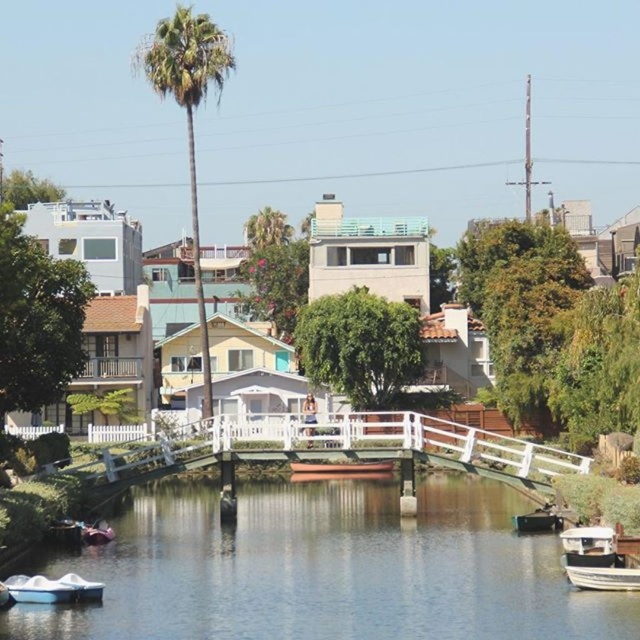
You are standing at the edge of the canal and notice a green leafy palm tree at upper left. If you want to take a photo of the palm tree with the white pedestrian bridge in the background, which direction should you face?

The green leafy palm tree at upper left is 81.70 meters from the viewer. To include the white pedestrian bridge in the background while photographing the palm tree, you should face towards the bridge, ensuring both the tree and bridge are within your camera frame.

You are a tourist standing on the white pedestrian bridge and want to take a photo of both the green leafy palm tree at upper left and the white glossy boat at lower right. Can you position yourself so that both are visible in the same frame without moving from your spot on the bridge?

Yes, since the green leafy palm tree at upper left is to the left of the white glossy boat at lower right, you can position yourself on the bridge facing towards the left side where the palm tree is located, ensuring both objects are within your camera frame.

You are a photographer planning to take a photo of the green leafy palm tree at upper left and the white matte boat at lower right. Which object appears larger in the photo?

The green leafy palm tree at upper left appears larger in the photo because it is much taller than the white matte boat at lower right.